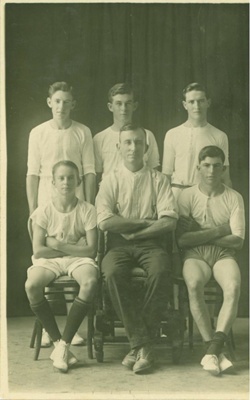
At what (x,y) coordinates should I click in order to perform the action: click on curtain. Please return your answer as a coordinate pair (x, y). Looking at the image, I should click on (168, 70).